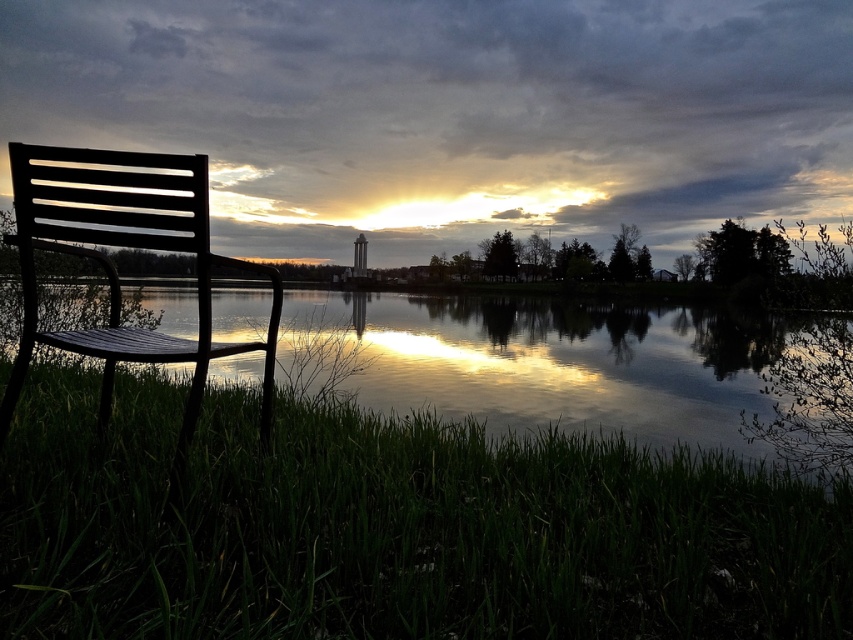
Looking at this image, does green grass at lower left appear over glossy water at chair left?

No, green grass at lower left is not above glossy water at chair left.

Can you confirm if green grass at lower left is bigger than glossy water at chair left?

No.

Who is more forward, (0, 563) or (582, 385)?

Point (0, 563) is in front.

I want to click on green grass at lower left, so pyautogui.click(x=393, y=529).

Which of these two, green grass at lower left or black metal chair at left, stands taller?

Standing taller between the two is black metal chair at left.

Between point (627, 529) and point (22, 176), which one is positioned behind?

Positioned behind is point (627, 529).

Does point (350, 454) lie behind point (186, 209)?

Yes, it is behind point (186, 209).

I want to click on green grass at lower left, so click(393, 529).

How far apart are glossy water at chair left and black metal chair at left?

A distance of 5.35 meters exists between glossy water at chair left and black metal chair at left.

Who is lower down, glossy water at chair left or black metal chair at left?

black metal chair at left

Between point (840, 353) and point (54, 212), which one is positioned behind?

Positioned behind is point (840, 353).

Locate an element on the screen. The width and height of the screenshot is (853, 640). glossy water at chair left is located at coordinates (549, 362).